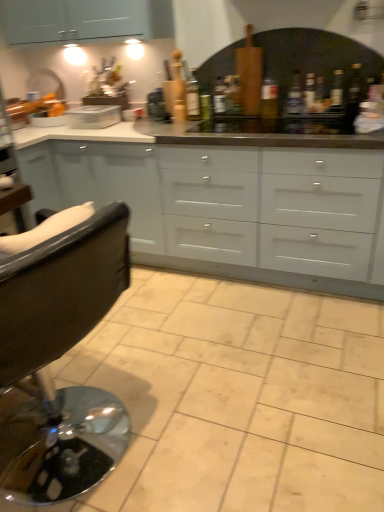
Question: Considering the positions of transparent glass bottle at upper right, which ranks as the 1th bottle in right-to-left order, and translucent glass bottle at upper right, which appears as the 2th bottle when viewed from the right, in the image, is transparent glass bottle at upper right, which ranks as the 1th bottle in right-to-left order, bigger or smaller than translucent glass bottle at upper right, which appears as the 2th bottle when viewed from the right,?

Choices:
 (A) small
 (B) big

Answer: (B)

Question: Considering the relative positions of transparent glass bottle at upper right, which ranks as the 1th bottle in right-to-left order, and translucent glass bottle at upper right, which appears as the 2th bottle when viewed from the right, in the image provided, is transparent glass bottle at upper right, which ranks as the 1th bottle in right-to-left order, to the left or to the right of translucent glass bottle at upper right, which appears as the 2th bottle when viewed from the right,?

Choices:
 (A) right
 (B) left

Answer: (A)

Question: Which is farther from the green glass bottle at center, placed as the 2th bottle when sorted from left to right?

Choices:
 (A) black leather chair at left
 (B) matte glass bottle at center, marked as the third bottle in a left-to-right arrangement
 (C) translucent glass bottle at upper right, which appears as the 2th bottle when viewed from the right
 (D) green glass bottle at center, the 1th bottle viewed from the left
 (E) beige ceramic tile at center

Answer: (A)

Question: Which object is the closest to the matte glass bottle at center, marked as the third bottle in a left-to-right arrangement?

Choices:
 (A) transparent glass bottle at upper right, the 6th bottle in the left-to-right sequence
 (B) black leather chair at left
 (C) green glass bottle at center, placed as the 2th bottle when sorted from left to right
 (D) white matte cupboard at center
 (E) beige ceramic tile at center

Answer: (C)